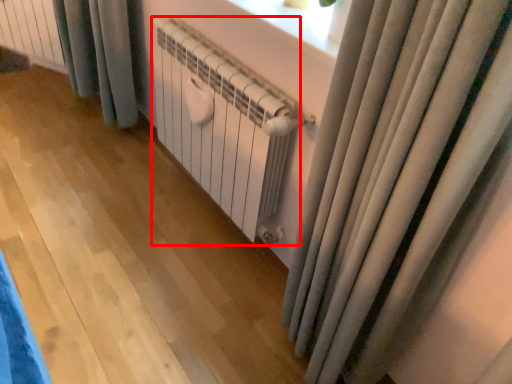
Question: From the image's perspective, what is the correct spatial relationship of radiator (annotated by the red box) in relation to radiator?

Choices:
 (A) below
 (B) above

Answer: (A)